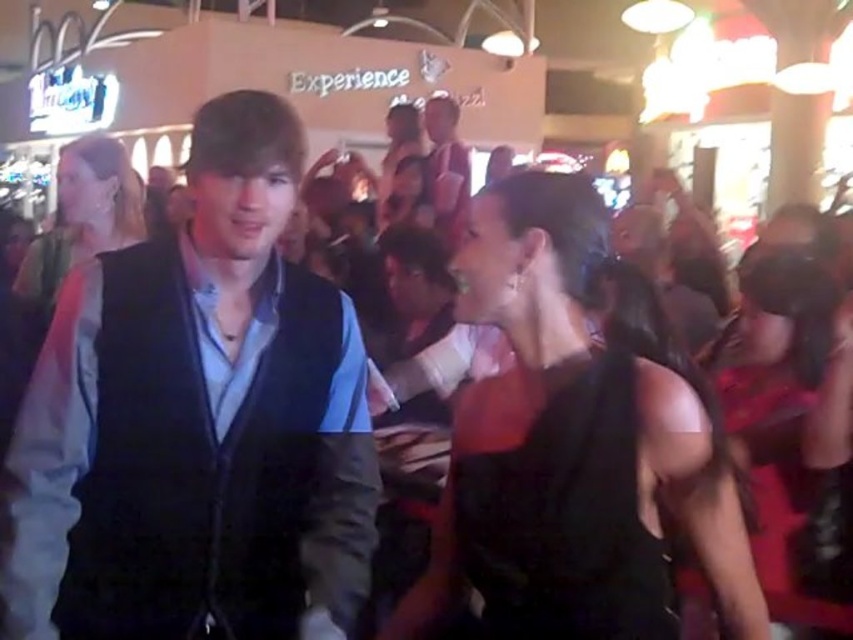
Measure the distance between dark blue vest at center and matte black vest at center.

11.26 feet

This screenshot has height=640, width=853. In order to click on dark blue vest at center in this screenshot , I will do `click(196, 422)`.

Who is positioned more to the right, black satin dress at center or matte black vest at center?

black satin dress at center is more to the right.

Does black satin dress at center have a smaller size compared to matte black vest at center?

Indeed, black satin dress at center has a smaller size compared to matte black vest at center.

Is point (482, 205) closer to camera compared to point (438, 157)?

Yes, it is.

I want to click on black satin dress at center, so click(x=575, y=438).

Image resolution: width=853 pixels, height=640 pixels. What are the coordinates of `matte black dress at center` in the screenshot? It's located at click(x=80, y=220).

Can you confirm if matte black dress at center is bigger than matte black vest at center?

No, matte black dress at center is not bigger than matte black vest at center.

Is point (123, 168) in front of point (434, 132)?

Yes, point (123, 168) is closer to viewer.

Locate an element on the screen. This screenshot has height=640, width=853. matte black dress at center is located at coordinates (80, 220).